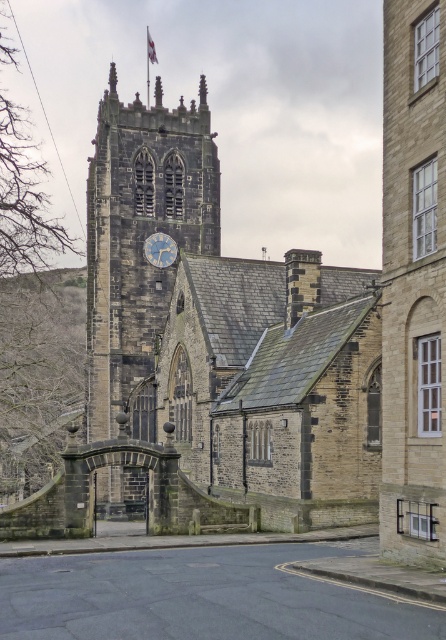
Is point (136, 307) less distant than point (173, 250)?

Yes, point (136, 307) is closer to viewer.

Can you confirm if stone clock tower at center is taller than blue painted metal clock at center?

Correct, stone clock tower at center is much taller as blue painted metal clock at center.

Locate an element on the screen. The height and width of the screenshot is (640, 446). stone clock tower at center is located at coordinates (140, 243).

Where is `stone clock tower at center`? stone clock tower at center is located at coordinates (140, 243).